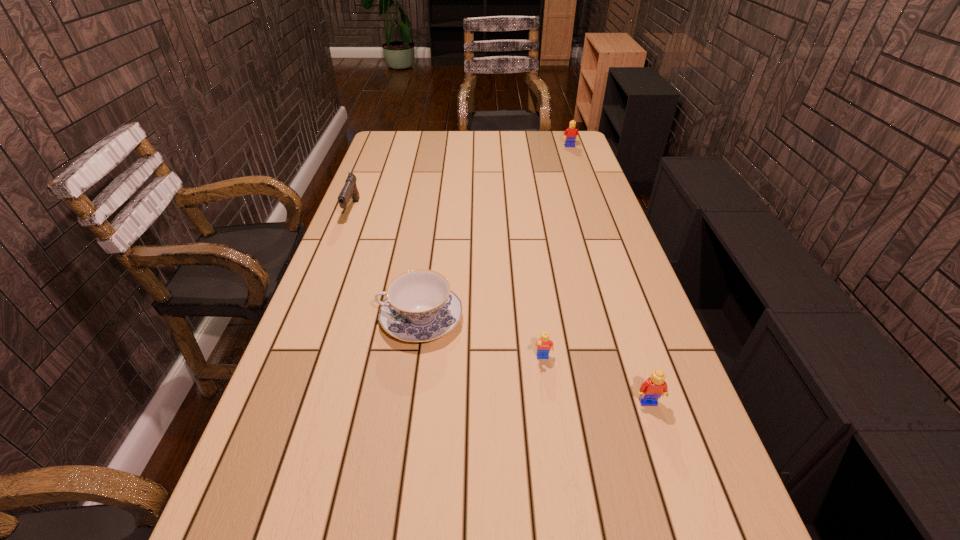
At what (x,y) coordinates should I click in order to perform the action: click on vacant space in between the farthest Lego and the gun. Please return your answer as a coordinate pair (x, y). This screenshot has height=540, width=960. Looking at the image, I should click on (461, 178).

Identify the location of object that is the second closest to the leftmost object. (544, 344).

I want to click on object that ranks as the fourth closest to the shortest Lego, so click(x=571, y=133).

Identify which Lego is the nearest to the second object from left to right. Please provide its 2D coordinates. Your answer should be formatted as a tuple, i.e. [(x, y)], where the tuple contains the x and y coordinates of a point satisfying the conditions above.

[(544, 344)]

Locate which Lego is the closest to the farthest object. Please provide its 2D coordinates. Your answer should be formatted as a tuple, i.e. [(x, y)], where the tuple contains the x and y coordinates of a point satisfying the conditions above.

[(544, 344)]

At what (x,y) coordinates should I click in order to perform the action: click on vacant space that satisfies the following two spatial constraints: 1. in the direction the gun is aimed; 2. with the handle on the side of the fourth object from right to left. Please return your answer as a coordinate pair (x, y). Image resolution: width=960 pixels, height=540 pixels. Looking at the image, I should click on (309, 319).

Where is `vacant region that satisfies the following two spatial constraints: 1. in the direction the second farthest object is aimed; 2. with the handle on the side of the third farthest object`? vacant region that satisfies the following two spatial constraints: 1. in the direction the second farthest object is aimed; 2. with the handle on the side of the third farthest object is located at coordinates (309, 319).

Locate an element on the screen. free space that satisfies the following two spatial constraints: 1. in the direction the fourth nearest object is aimed; 2. with the handle on the side of the fourth object from right to left is located at coordinates (309, 319).

Find the location of a particular element. This screenshot has width=960, height=540. free spot that satisfies the following two spatial constraints: 1. with the handle on the side of the chinaware; 2. in the direction the second farthest object is aimed is located at coordinates (436, 210).